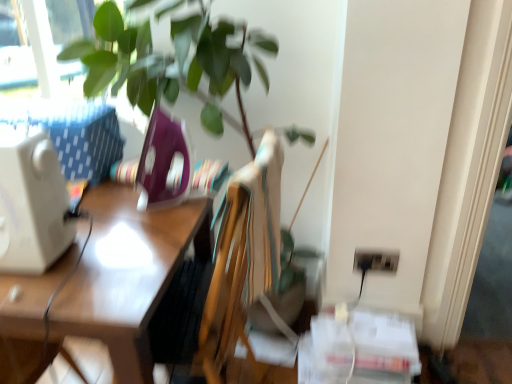
Question: Considering the relative sizes of wooden desk at left and white plastic desktop computer at left in the image provided, is wooden desk at left smaller than white plastic desktop computer at left?

Choices:
 (A) no
 (B) yes

Answer: (A)

Question: Does wooden desk at left have a lesser height compared to white plastic desktop computer at left?

Choices:
 (A) no
 (B) yes

Answer: (A)

Question: From the image's perspective, is wooden desk at left on top of white plastic desktop computer at left?

Choices:
 (A) no
 (B) yes

Answer: (A)

Question: Is wooden desk at left turned away from white plastic desktop computer at left?

Choices:
 (A) no
 (B) yes

Answer: (A)

Question: Can you confirm if wooden desk at left is bigger than white plastic desktop computer at left?

Choices:
 (A) no
 (B) yes

Answer: (B)

Question: Is wooden desk at left far away from white plastic desktop computer at left?

Choices:
 (A) no
 (B) yes

Answer: (A)

Question: Is black plastic electric outlet at lower right wider than wooden desk at left?

Choices:
 (A) no
 (B) yes

Answer: (A)

Question: Can you confirm if black plastic electric outlet at lower right is positioned to the left of wooden desk at left?

Choices:
 (A) yes
 (B) no

Answer: (B)

Question: Can you see black plastic electric outlet at lower right touching wooden desk at left?

Choices:
 (A) yes
 (B) no

Answer: (B)

Question: Is black plastic electric outlet at lower right shorter than wooden desk at left?

Choices:
 (A) no
 (B) yes

Answer: (B)

Question: Does black plastic electric outlet at lower right have a greater height compared to wooden desk at left?

Choices:
 (A) yes
 (B) no

Answer: (B)

Question: From a real-world perspective, is black plastic electric outlet at lower right under wooden desk at left?

Choices:
 (A) yes
 (B) no

Answer: (B)

Question: From the image's perspective, is wooden desk at left located above black plastic electric outlet at lower right?

Choices:
 (A) yes
 (B) no

Answer: (B)